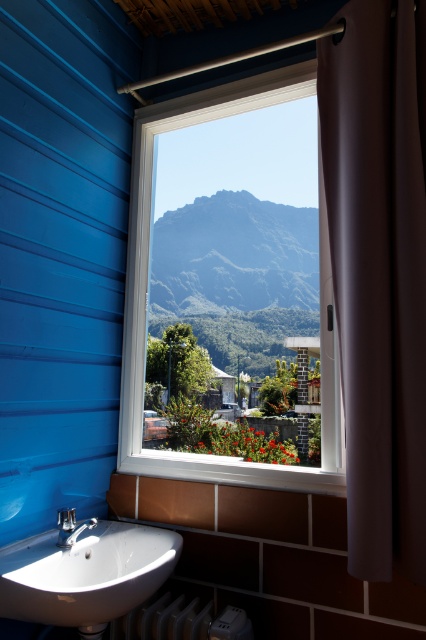
You are a painter standing in the bathroom and want to paint the view outside the window. You have a 5 feet long ladder to reach the window. The brown fabric curtain at right and green textured mountain at center are in your way. Can you reach the window without moving them?

The brown fabric curtain at right and green textured mountain at center are 6.06 feet apart from each other. Since the ladder is 5 feet long, the painter cannot reach the window without moving the objects because the distance between them is greater than the ladder length.

You are standing in the bathroom and want to know how far you are from the point marked at coordinates point (347, 74). Can you determine the distance?

The distance between you and the point marked at coordinates point (347, 74) is 5.40 feet.